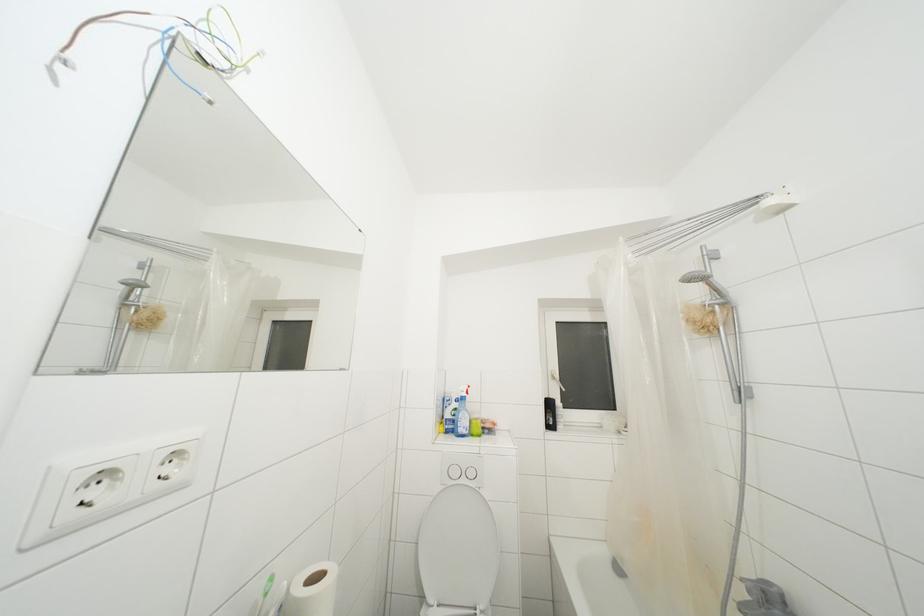
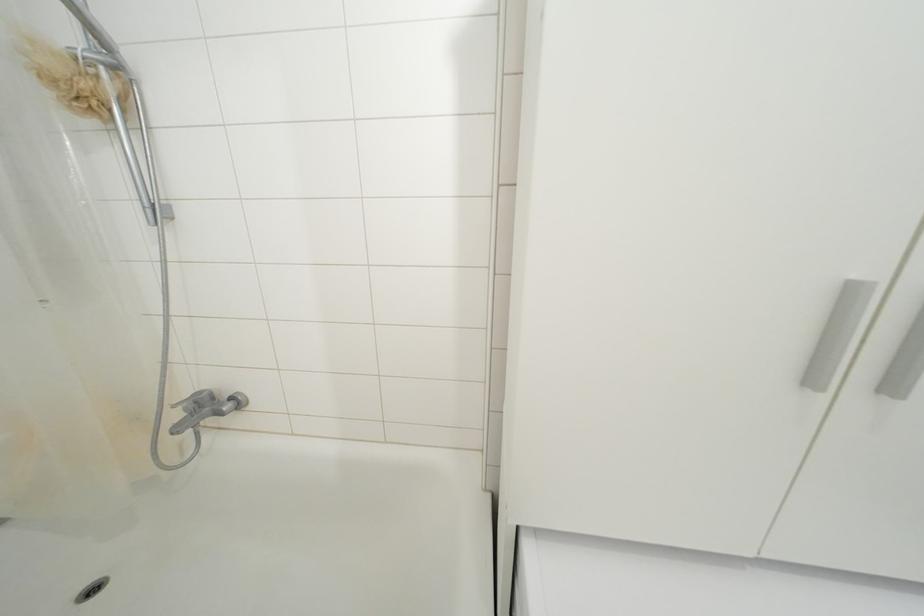
In the second image, find the point that corresponds to pixel 718 317 in the first image.

(100, 79)